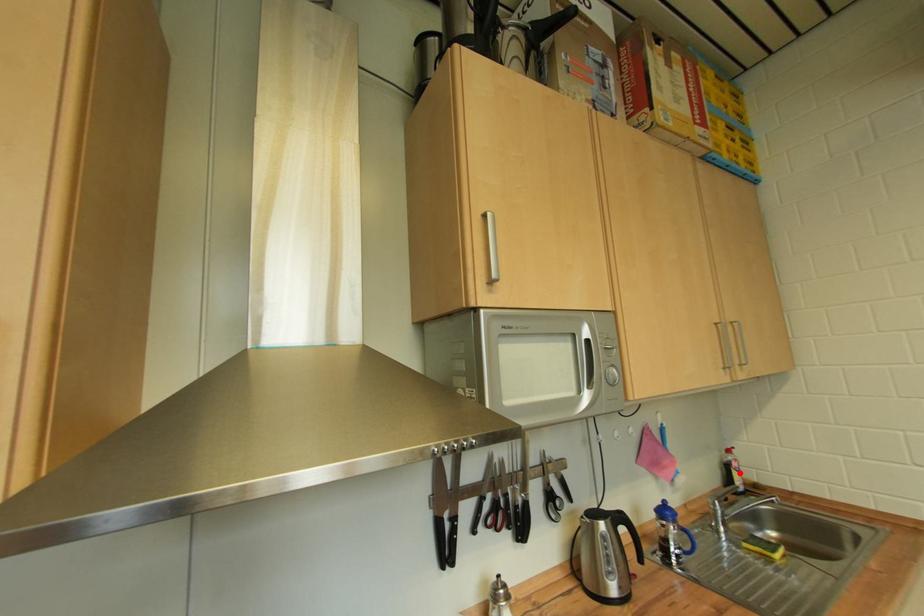
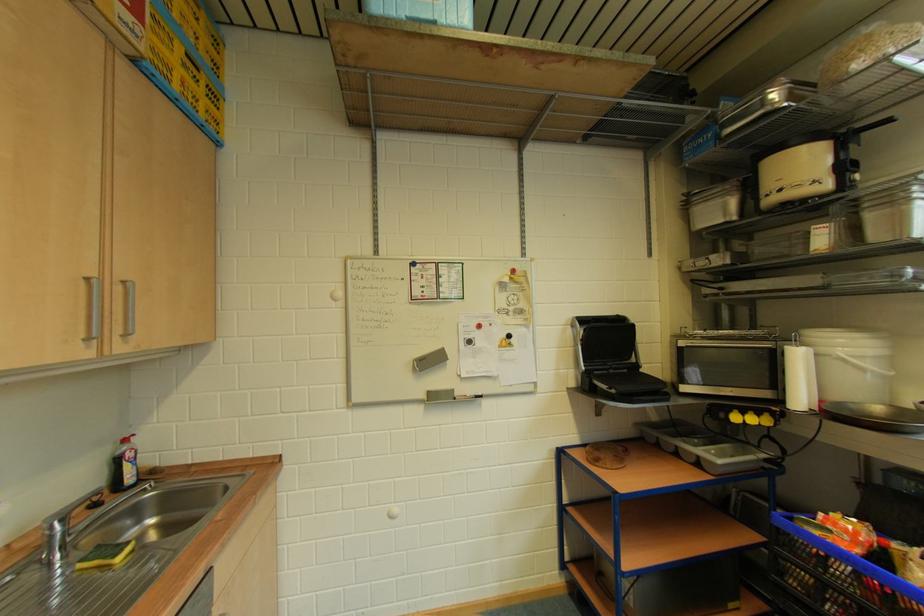
In the second image, find the point that corresponds to the highlighted location in the first image.

(132, 464)